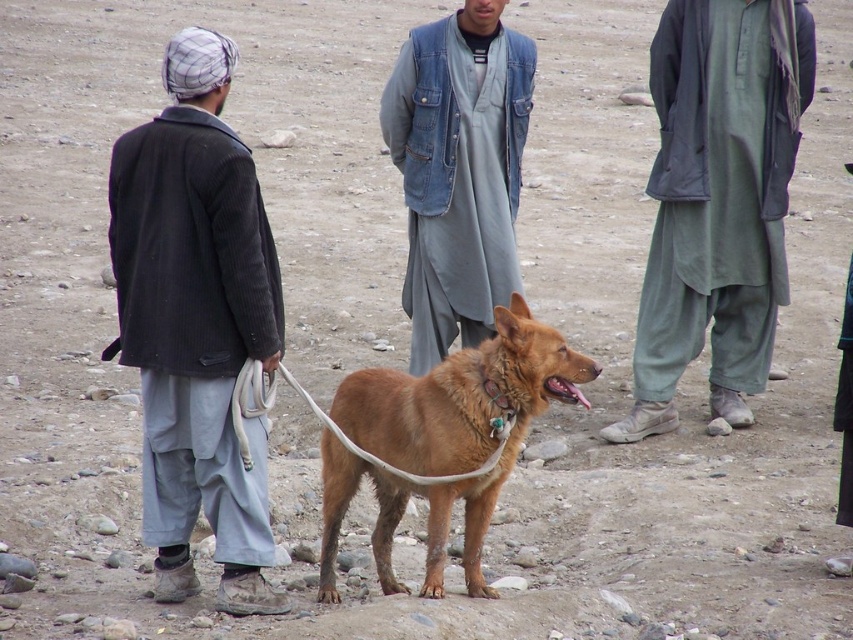
You are standing at the point labeled point (212,417) and want to walk to the point labeled point (747,349). Which direction should you face to move toward your destination?

You should face away from the viewer because point (747,349) is farther from you than point (212,417).